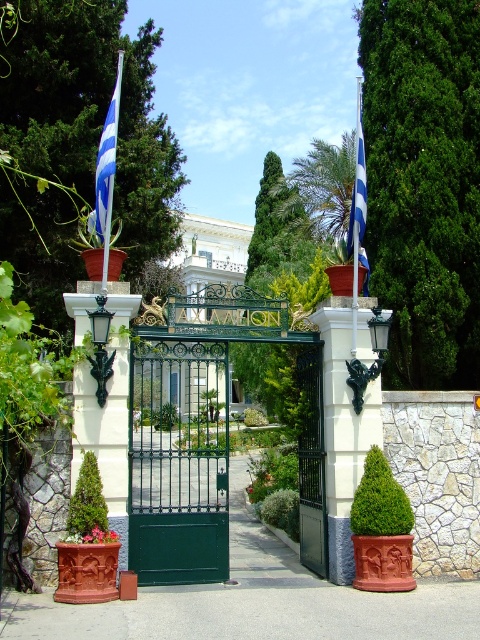
Does green leafy tree at upper center have a lesser width compared to blue striped flag at upper left?

In fact, green leafy tree at upper center might be wider than blue striped flag at upper left.

Is point (384, 29) positioned before point (108, 129)?

No, (384, 29) is behind (108, 129).

Which is behind, point (454, 342) or point (107, 164)?

Point (454, 342)

Locate an element on the screen. This screenshot has height=640, width=480. green leafy tree at upper center is located at coordinates (423, 182).

Does blue striped flag at upper left appear on the left side of blue and white striped flag at center?

Yes, blue striped flag at upper left is to the left of blue and white striped flag at center.

Consider the image. Who is taller, blue striped flag at upper left or blue and white striped flag at center?

Standing taller between the two is blue and white striped flag at center.

The height and width of the screenshot is (640, 480). In order to click on blue striped flag at upper left in this screenshot , I will do tap(107, 166).

Where is `blue striped flag at upper left`? Image resolution: width=480 pixels, height=640 pixels. blue striped flag at upper left is located at coordinates (107, 166).

Is point (302, 422) farther from camera compared to point (357, 237)?

Yes, it is.

Where is `green metal gate at center`? The height and width of the screenshot is (640, 480). green metal gate at center is located at coordinates (312, 461).